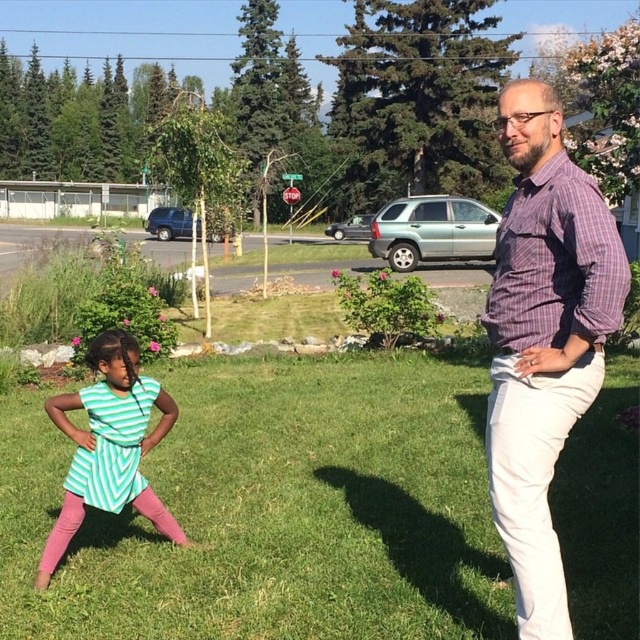
This screenshot has width=640, height=640. In order to click on green grass at center in this screenshot , I will do `click(275, 509)`.

This screenshot has width=640, height=640. Describe the element at coordinates (275, 509) in the screenshot. I see `green grass at center` at that location.

The width and height of the screenshot is (640, 640). I want to click on green grass at center, so point(275,509).

Is point (566, 324) positioned after point (113, 392)?

No, (566, 324) is closer to viewer.

Between purple checkered shirt at right and green striped dress at lower left, which one appears on the left side from the viewer's perspective?

From the viewer's perspective, green striped dress at lower left appears more on the left side.

Which is behind, point (497, 348) or point (51, 550)?

The point (51, 550) is behind.

What are the coordinates of `purple checkered shirt at right` in the screenshot? It's located at (544, 339).

Who is lower down, green grass at center or purple checkered shirt at right?

Positioned lower is green grass at center.

Is green grass at center above purple checkered shirt at right?

Actually, green grass at center is below purple checkered shirt at right.

Find the location of `green grass at center`. green grass at center is located at coordinates (275, 509).